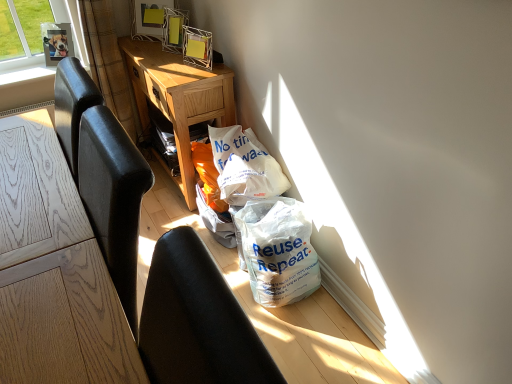
You are a GUI agent. You are given a task and a screenshot of the screen. Output one action in this format:
    pyautogui.click(x=<x>, y=<y>)
    Task: Click on the vacant space situated above black leather chair at lower left (from a real-world perspective)
    The image size is (512, 384).
    Given the screenshot: What is the action you would take?
    pyautogui.click(x=202, y=296)